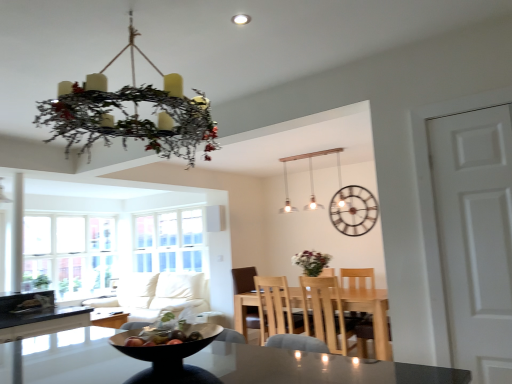
Describe the element at coordinates (374, 319) in the screenshot. This screenshot has height=384, width=512. I see `light wood table at center` at that location.

What are the coordinates of `white glass window screen at left` in the screenshot? It's located at (169, 241).

Is matte white pendant lights at upper center at the back of white matte door at right?

No, white matte door at right's orientation is not away from matte white pendant lights at upper center.

From the image's perspective, which is below, white matte door at right or matte white pendant lights at upper center?

From the image's view, white matte door at right is below.

Who is smaller, white matte door at right or matte white pendant lights at upper center?

white matte door at right.

Which of these two, matte wooden table at center or light wood table at center, stands shorter?

With less height is matte wooden table at center.

Relative to light wood table at center, is matte wooden table at center in front or behind?

Visually, matte wooden table at center is located in front of light wood table at center.

Which object is positioned more to the left, matte wooden table at center or light wood table at center?

From the viewer's perspective, matte wooden table at center appears more on the left side.

Where is `table on the right of matte wooden table at center`? This screenshot has width=512, height=384. table on the right of matte wooden table at center is located at coordinates (374, 319).

Can you tell me how much white fabric couch at lower left and white matte door at right differ in facing direction?

They differ by 1.29 degrees in their facing directions.

Relative to white matte door at right, is white fabric couch at lower left in front or behind?

Clearly, white fabric couch at lower left is behind white matte door at right.

Considering the relative sizes of white fabric couch at lower left and white matte door at right in the image provided, is white fabric couch at lower left thinner than white matte door at right?

No, white fabric couch at lower left is not thinner than white matte door at right.

Where is `couch on the left of white matte door at right`? couch on the left of white matte door at right is located at coordinates (156, 294).

Measure the distance from matte wooden table at center to metallic wire wreath at upper center.

A distance of 8.61 feet exists between matte wooden table at center and metallic wire wreath at upper center.

Is matte wooden table at center facing towards metallic wire wreath at upper center?

No, matte wooden table at center is not facing towards metallic wire wreath at upper center.

Which is behind, point (54, 374) or point (137, 101)?

The point (54, 374) is farther.

Is matte wooden table at center taller than metallic wire wreath at upper center?

No.

From a real-world perspective, is metallic wire wreath at upper center physically below matte wooden table at center?

No, from a real-world perspective, metallic wire wreath at upper center is not under matte wooden table at center.

In terms of height, does metallic wire wreath at upper center look taller or shorter compared to matte wooden table at center?

metallic wire wreath at upper center is taller than matte wooden table at center.

Could you tell me if metallic wire wreath at upper center is turned towards matte wooden table at center?

No, metallic wire wreath at upper center does not turn towards matte wooden table at center.

Is metallic wire wreath at upper center beside light wood chair at center?

They are not placed beside each other.

Is metallic wire wreath at upper center turned away from light wood chair at center?

That's not correct — metallic wire wreath at upper center is not looking away from light wood chair at center.

Is metallic wire wreath at upper center inside or outside of light wood chair at center?

metallic wire wreath at upper center is located beyond the bounds of light wood chair at center.

Which of these two, metallic wire wreath at upper center or light wood chair at center, is thinner?

Thinner between the two is light wood chair at center.

Is there a large distance between shiny plastic bowl at center and white fabric couch at lower left?

That's not correct — shiny plastic bowl at center is a little close to white fabric couch at lower left.

Is shiny plastic bowl at center wider or thinner than white fabric couch at lower left?

Considering their sizes, shiny plastic bowl at center looks slimmer than white fabric couch at lower left.

How different are the orientations of shiny plastic bowl at center and white fabric couch at lower left in degrees?

20.8 degrees.

Locate an element on the screen. The width and height of the screenshot is (512, 384). couch behind the shiny plastic bowl at center is located at coordinates (156, 294).

Where is `lamp to the left of white matte door at right`? lamp to the left of white matte door at right is located at coordinates (310, 178).

Where is `table behind the matte wooden table at center`? The image size is (512, 384). table behind the matte wooden table at center is located at coordinates tap(374, 319).

Estimate the real-world distances between objects in this image. Which object is further from shiny plastic bowl at center, matte wooden table at center or white fabric couch at lower left?

Based on the image, matte wooden table at center appears to be further to shiny plastic bowl at center.

Which object lies nearer to the anchor point light wood chair at center, matte wooden table at center or white matte door at right?

matte wooden table at center lies closer to light wood chair at center than the other object.

Considering their positions, is metallic wire wreath at upper center positioned further to light wood chair at center than clear glass window at left?

metallic wire wreath at upper center lies further to light wood chair at center than the other object.

When comparing their distances from light wood table at center, does metallic clock at upper center or metallic wire wreath at upper center seem further?

Based on the image, metallic wire wreath at upper center appears to be further to light wood table at center.

In the scene shown: From the image, which object appears to be farther from metallic clock at upper center, white fabric couch at lower left or white glass window screen at left?

Among the two, white fabric couch at lower left is located further to metallic clock at upper center.

Considering their positions, is light wood table at center positioned further to clear glass window at left than white fabric couch at lower left?

light wood table at center lies further to clear glass window at left than the other object.

Looking at the image, which one is located further to matte white pendant lights at upper center, clear glass window at left or matte wooden table at center?

matte wooden table at center is positioned further to the anchor matte white pendant lights at upper center.

From the image, which object appears to be nearer to metallic wire wreath at upper center, white fabric couch at lower left or clear glass window at left?

Among the two, clear glass window at left is located nearer to metallic wire wreath at upper center.

The height and width of the screenshot is (384, 512). I want to click on kitchen & dining room table located between white matte door at right and metallic clock at upper center in the depth direction, so click(x=310, y=367).

Where is `table between metallic wire wreath at upper center and white fabric couch at lower left from front to back`? The image size is (512, 384). table between metallic wire wreath at upper center and white fabric couch at lower left from front to back is located at coordinates (374, 319).

Locate an element on the screen. This screenshot has width=512, height=384. door located between shiny plastic bowl at center and matte white pendant lights at upper center in the depth direction is located at coordinates (475, 236).

Find the location of a particular element. Image resolution: width=512 pixels, height=384 pixels. window screen between clear glass window at left and matte white pendant lights at upper center from left to right is located at coordinates (169, 241).